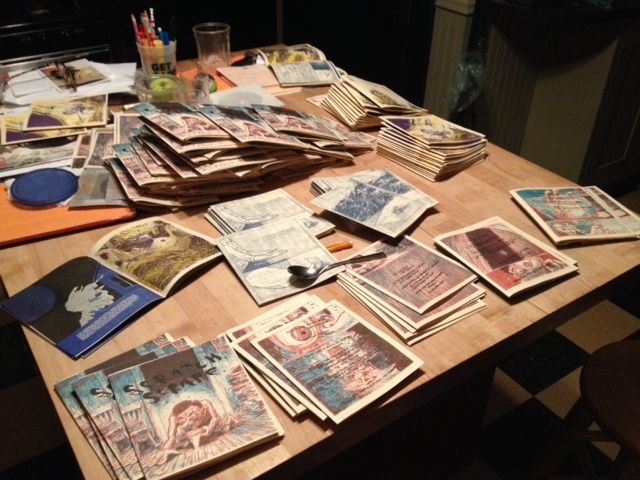
This screenshot has width=640, height=480. Identify the location of orange placemat. (61, 220), (220, 85).